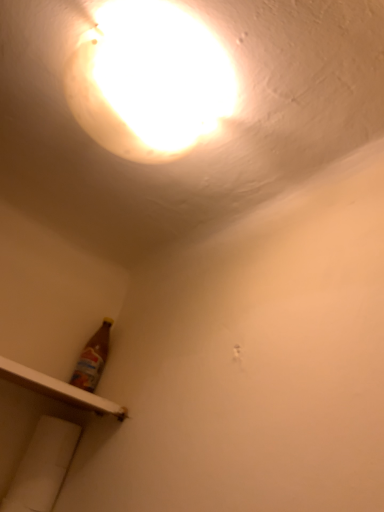
Question: From a real-world perspective, is white plastic shelf at lower left positioned under matte white light at upper center based on gravity?

Choices:
 (A) yes
 (B) no

Answer: (A)

Question: Considering the relative sizes of white plastic shelf at lower left and matte white light at upper center in the image provided, is white plastic shelf at lower left wider than matte white light at upper center?

Choices:
 (A) yes
 (B) no

Answer: (A)

Question: From a real-world perspective, is white plastic shelf at lower left physically above matte white light at upper center?

Choices:
 (A) no
 (B) yes

Answer: (A)

Question: Is white plastic shelf at lower left turned away from matte white light at upper center?

Choices:
 (A) no
 (B) yes

Answer: (A)

Question: Is white plastic shelf at lower left to the right of matte white light at upper center from the viewer's perspective?

Choices:
 (A) no
 (B) yes

Answer: (A)

Question: Can you confirm if white plastic shelf at lower left is taller than matte white light at upper center?

Choices:
 (A) yes
 (B) no

Answer: (B)

Question: Can we say matte white light at upper center lies outside white plastic shelf at lower left?

Choices:
 (A) no
 (B) yes

Answer: (B)

Question: Are matte white light at upper center and white plastic shelf at lower left far apart?

Choices:
 (A) no
 (B) yes

Answer: (A)

Question: Considering the relative sizes of matte white light at upper center and white plastic shelf at lower left in the image provided, is matte white light at upper center wider than white plastic shelf at lower left?

Choices:
 (A) no
 (B) yes

Answer: (A)

Question: Can you confirm if matte white light at upper center is bigger than white plastic shelf at lower left?

Choices:
 (A) yes
 (B) no

Answer: (A)

Question: Is matte white light at upper center taller than white plastic shelf at lower left?

Choices:
 (A) no
 (B) yes

Answer: (B)

Question: From a real-world perspective, is matte white light at upper center on white plastic shelf at lower left?

Choices:
 (A) yes
 (B) no

Answer: (A)

Question: Is matte white light at upper center bigger or smaller than white plastic shelf at lower left?

Choices:
 (A) small
 (B) big

Answer: (B)